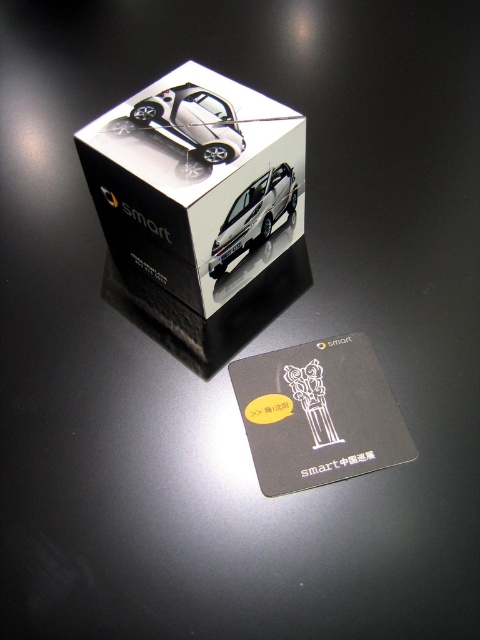
Please describe the object located at the coordinates point (194, 120) in the scene described above.

The object at point (194, 120) is the satin silver car at center.

What are the coordinates of the satin silver car at center?

The satin silver car at center is located at point (194, 120).